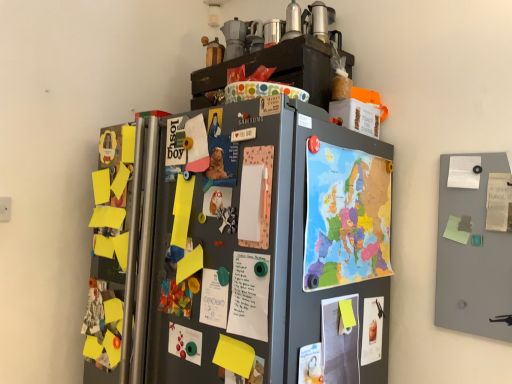
Question: Looking at their shapes, would you say matte white poster at lower center, which is the third poster from right to left, is wider or thinner than smooth gray board at right?

Choices:
 (A) thin
 (B) wide

Answer: (A)

Question: Would you say matte white poster at lower center, which is the third poster from right to left, is to the left or to the right of smooth gray board at right in the picture?

Choices:
 (A) left
 (B) right

Answer: (A)

Question: Which is farther from the matte paper poster at right, the first poster when ordered from right to left?

Choices:
 (A) matte paper poster at lower right, the fifth poster when ordered from left to right
 (B) metallic silver canisters at upper center, the first appliance in the front-to-back sequence
 (C) matte paper poster at lower left, which is the sixth poster from right to left
 (D) colorful paper map at right
 (E) metallic silver coffee pot at upper center, the second appliance from the left

Answer: (C)

Question: Estimate the real-world distances between objects in this image. Which object is closer to the matte paper poster at right, positioned as the sixth poster in left-to-right order?

Choices:
 (A) white paper at center, the 3th poster when ordered from left to right
 (B) smooth gray board at right
 (C) metallic silver coffee pot at upper center, which is the 2th appliance from front to back
 (D) metallic silver canisters at upper center, marked as the 2th appliance in a right-to-left arrangement
 (E) matte paper poster at center, acting as the 2th poster starting from the left

Answer: (B)